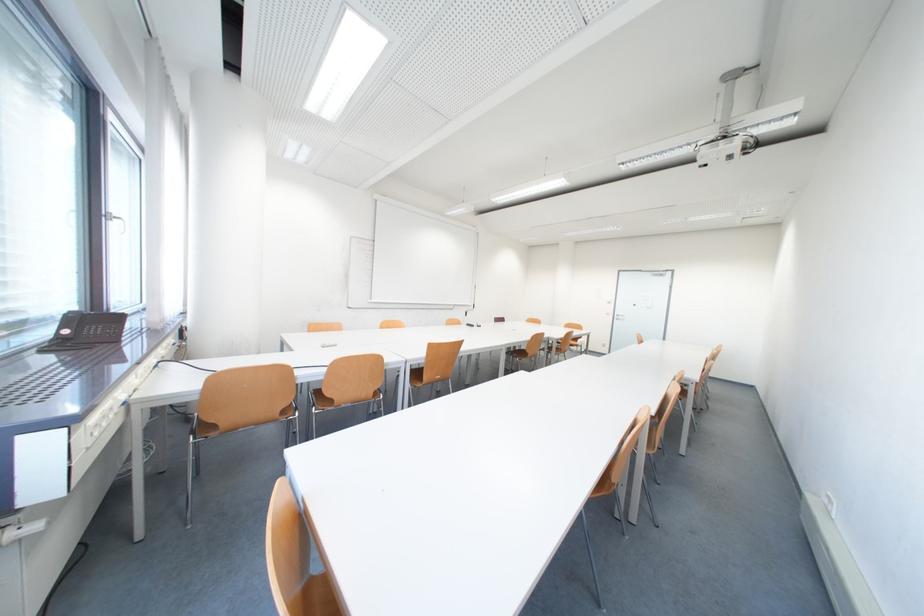
This screenshot has width=924, height=616. I want to click on silver door handle, so click(116, 221).